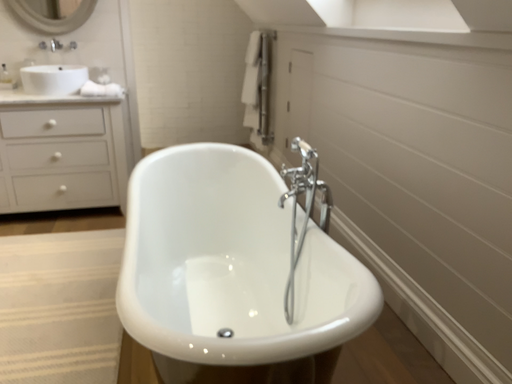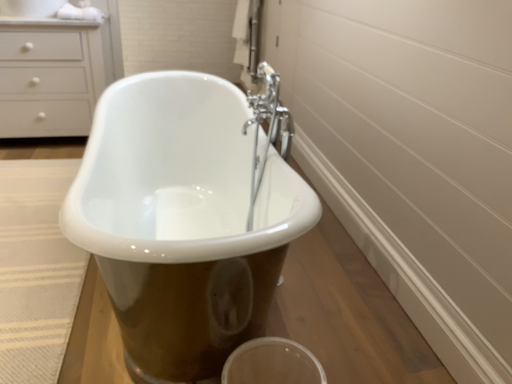
Question: Which way did the camera rotate in the video?

Choices:
 (A) rotated upward
 (B) rotated downward

Answer: (B)